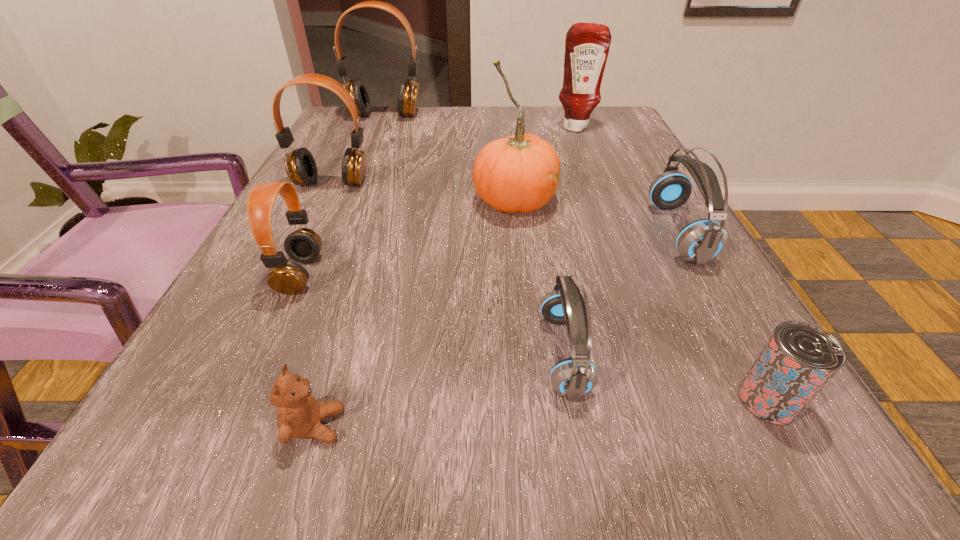
Identify the location of vacant area situated on the ear cups of the bigger blue headset. The height and width of the screenshot is (540, 960). (455, 233).

This screenshot has height=540, width=960. What are the coordinates of `free spot located on the ear cups of the bigger blue headset` in the screenshot? It's located at (541, 233).

Find the location of a particular element. The width and height of the screenshot is (960, 540). vacant position located 0.280m on the ear cups of the left blue headset is located at coordinates (326, 354).

Identify the location of vacant region located 0.120m on the ear cups of the left blue headset. (450, 354).

Locate an element on the screen. free space located on the ear cups of the left blue headset is located at coordinates (388, 354).

The width and height of the screenshot is (960, 540). In order to click on free space located on the back of the red beer can in this screenshot , I will do `click(708, 292)`.

The height and width of the screenshot is (540, 960). I want to click on free spot located on the face of the teddy bear, so click(520, 426).

Identify the location of headset at the far edge. This screenshot has width=960, height=540. point(408,91).

Identify the location of condiment that is at the far edge. The width and height of the screenshot is (960, 540). (587, 45).

Find the location of a particular element. object located in the near edge section of the desktop is located at coordinates (299, 414).